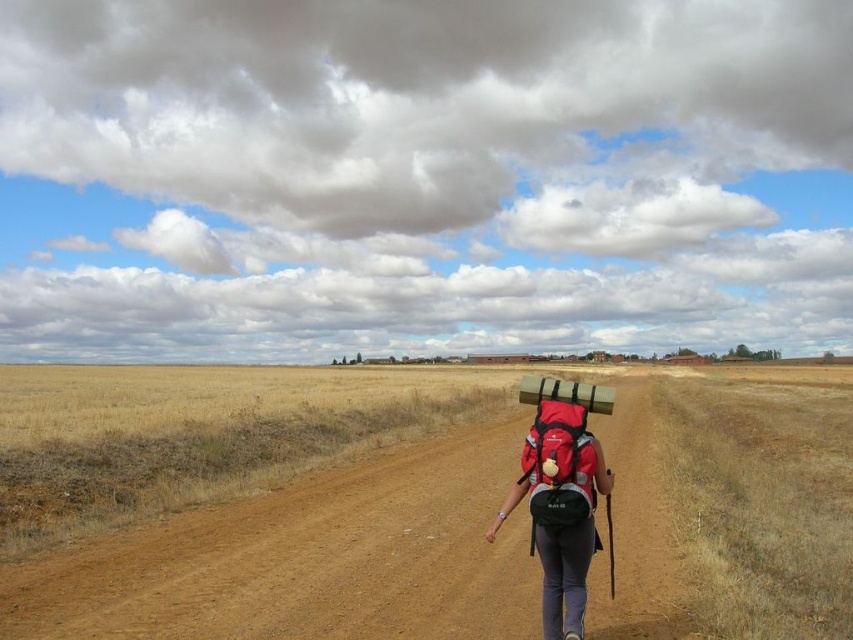
Question: Which of the following is the closest to the observer?

Choices:
 (A) pyautogui.click(x=654, y=554)
 (B) pyautogui.click(x=579, y=481)
 (C) pyautogui.click(x=550, y=518)

Answer: (B)

Question: Estimate the real-world distances between objects in this image. Which object is closer to the red matte backpack at center?

Choices:
 (A) matte red backpack at center
 (B) brown dirt track at center

Answer: (A)

Question: Which point is closer to the camera?

Choices:
 (A) (10, 618)
 (B) (538, 384)

Answer: (A)

Question: Is red matte backpack at center closer to camera compared to matte red backpack at center?

Choices:
 (A) yes
 (B) no

Answer: (A)

Question: Considering the relative positions of red matte backpack at center and matte red backpack at center in the image provided, where is red matte backpack at center located with respect to matte red backpack at center?

Choices:
 (A) below
 (B) above

Answer: (A)

Question: Does red matte backpack at center have a smaller size compared to matte red backpack at center?

Choices:
 (A) yes
 (B) no

Answer: (B)